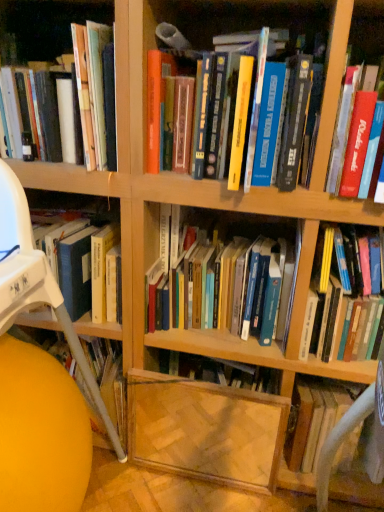
Describe the element at coordinates (41, 433) in the screenshot. I see `matte yellow ball at lower left` at that location.

At what (x,y) coordinates should I click in order to perform the action: click on hardcover books at center, which is counted as the 4th book, starting from the right. Please return your answer as a coordinate pair (x, y). Looking at the image, I should click on (176, 42).

What do you see at coordinates (352, 129) in the screenshot? The image size is (384, 512). I see `red matte book at upper right, which is the fourth book in left-to-right order` at bounding box center [352, 129].

Looking at this image, what is the approximate width of red matte book at upper right, which is the fourth book in left-to-right order?

red matte book at upper right, which is the fourth book in left-to-right order, is 36.42 centimeters wide.

What is the approximate width of white fabric computer chair at right?

white fabric computer chair at right is 14.34 inches wide.

I want to click on matte yellow ball at lower left, so click(x=41, y=433).

Based on their positions, is matte yellow ball at lower left located to the left or right of white fabric computer chair at right?

matte yellow ball at lower left is to the left of white fabric computer chair at right.

Which is behind, point (5, 429) or point (347, 423)?

Positioned behind is point (5, 429).

Would you say matte yellow ball at lower left is a long distance from white fabric computer chair at right?

No, matte yellow ball at lower left is in close proximity to white fabric computer chair at right.

From the picture: Is matte yellow ball at lower left smaller than white fabric computer chair at right?

No.

Considering the points (339, 440) and (352, 169), which point is behind, point (339, 440) or point (352, 169)?

The point (352, 169) is farther.

Choose the correct answer: Is white fabric computer chair at right inside red matte book at upper right, acting as the 2th book starting from the right, or outside it?

white fabric computer chair at right is outside red matte book at upper right, acting as the 2th book starting from the right.

From the image's perspective, does white fabric computer chair at right appear lower than red matte book at upper right, acting as the 2th book starting from the right?

Yes.

Does point (14, 434) appear closer or farther from the camera than point (282, 300)?

Point (14, 434) is positioned closer to the camera compared to point (282, 300).

From their relative heights in the image, would you say matte yellow ball at lower left is taller or shorter than hardcover books at center, the third book when ordered from right to left?

matte yellow ball at lower left is taller than hardcover books at center, the third book when ordered from right to left.

From a real-world perspective, is matte yellow ball at lower left positioned over hardcover books at center, the third book when ordered from left to right, based on gravity?

No.

From the image's perspective, which one is positioned higher, matte yellow ball at lower left or hardcover books at center, the third book when ordered from right to left?

From the image's view, hardcover books at center, the third book when ordered from right to left, is above.

Between hardcover book at upper left, the 1th book from the left, and hardcover book at center right, the 1th book when ordered from right to left, which one is positioned behind?

hardcover book at upper left, the 1th book from the left, is further away from the camera.

Looking at their sizes, would you say hardcover book at upper left, the fifth book when ordered from right to left, is wider or thinner than hardcover book at center right, which is counted as the 5th book, starting from the left?

Considering their sizes, hardcover book at upper left, the fifth book when ordered from right to left, looks slimmer than hardcover book at center right, which is counted as the 5th book, starting from the left.

Is hardcover book at upper left, the 1th book from the left, far from hardcover book at center right, which is counted as the 5th book, starting from the left?

hardcover book at upper left, the 1th book from the left, is actually quite close to hardcover book at center right, which is counted as the 5th book, starting from the left.

Is point (114, 135) closer or farther from the camera than point (372, 409)?

Point (114, 135) appears to be farther away from the viewer than point (372, 409).

Can white fabric computer chair at right be found inside hardcover book at upper left, the fifth book when ordered from right to left?

No, white fabric computer chair at right is not surrounded by hardcover book at upper left, the fifth book when ordered from right to left.

Are hardcover book at upper left, the fifth book when ordered from right to left, and white fabric computer chair at right making contact?

No.

From the image's perspective, does hardcover book at upper left, the fifth book when ordered from right to left, appear lower than white fabric computer chair at right?

No.

Which of these two, hardcover book at center right, which is counted as the 5th book, starting from the left, or hardcover books at center, the second book when ordered from left to right, stands taller?

hardcover book at center right, which is counted as the 5th book, starting from the left, is taller.

How much distance is there between hardcover book at center right, which is counted as the 5th book, starting from the left, and hardcover books at center, which is counted as the 4th book, starting from the right?

The distance of hardcover book at center right, which is counted as the 5th book, starting from the left, from hardcover books at center, which is counted as the 4th book, starting from the right, is 14.66 inches.

Considering the relative positions of hardcover book at center right, the 1th book when ordered from right to left, and hardcover books at center, the second book when ordered from left to right, in the image provided, is hardcover book at center right, the 1th book when ordered from right to left, to the right of hardcover books at center, the second book when ordered from left to right, from the viewer's perspective?

Correct, you'll find hardcover book at center right, the 1th book when ordered from right to left, to the right of hardcover books at center, the second book when ordered from left to right.

Is hardcover book at center right, the 1th book when ordered from right to left, directly adjacent to hardcover books at center, which is counted as the 4th book, starting from the right?

No, hardcover book at center right, the 1th book when ordered from right to left, is not beside hardcover books at center, which is counted as the 4th book, starting from the right.

Looking at this image, are hardcover book at upper left, the fifth book when ordered from right to left, and matte yellow ball at lower left making contact?

There is a gap between hardcover book at upper left, the fifth book when ordered from right to left, and matte yellow ball at lower left.

From a real-world perspective, who is located higher, hardcover book at upper left, the fifth book when ordered from right to left, or matte yellow ball at lower left?

hardcover book at upper left, the fifth book when ordered from right to left, is physically above.

Between hardcover book at upper left, the fifth book when ordered from right to left, and matte yellow ball at lower left, which one has less height?

hardcover book at upper left, the fifth book when ordered from right to left, is shorter.

Could you measure the distance between hardcover book at upper left, the fifth book when ordered from right to left, and matte yellow ball at lower left?

hardcover book at upper left, the fifth book when ordered from right to left, is 53.44 centimeters away from matte yellow ball at lower left.

Where is `computer chair located on the right of matte yellow ball at lower left`? This screenshot has height=512, width=384. computer chair located on the right of matte yellow ball at lower left is located at coordinates pyautogui.click(x=350, y=432).

Find the location of a particular element. Image resolution: width=384 pixels, height=512 pixels. the 3rd book above when counting from the white fabric computer chair at right (from the image's perspective) is located at coordinates (352, 129).

When comparing their distances from hardcover books at center, the third book when ordered from left to right, does white fabric computer chair at right or red matte book at upper right, acting as the 2th book starting from the right, seem further?

white fabric computer chair at right lies further to hardcover books at center, the third book when ordered from left to right, than the other object.

From the image, which object appears to be farther from wooden bookshelf at left, which is the 2th shelf in right-to-left order, hardcover book at center right, the 1th book when ordered from right to left, or hardcover books at center, the third book when ordered from right to left?

Based on the image, hardcover book at center right, the 1th book when ordered from right to left, appears to be further to wooden bookshelf at left, which is the 2th shelf in right-to-left order.

Considering their positions, is transparent glass shelf at lower center, the second shelf viewed from the left, positioned further to hardcover book at upper left, the 1th book from the left, than hardcover books at center, which is counted as the 4th book, starting from the right?

transparent glass shelf at lower center, the second shelf viewed from the left.

Estimate the real-world distances between objects in this image. Which object is further from hardcover books at center, the third book when ordered from left to right, transparent glass shelf at lower center, the second shelf viewed from the left, or hardcover book at center right, the 1th book when ordered from right to left?

Based on the image, transparent glass shelf at lower center, the second shelf viewed from the left, appears to be further to hardcover books at center, the third book when ordered from left to right.

Considering their positions, is white fabric computer chair at right positioned closer to wooden bookshelf at left, which ranks as the first shelf in left-to-right order, than transparent glass shelf at lower center, the second shelf viewed from the left?

The object closer to wooden bookshelf at left, which ranks as the first shelf in left-to-right order, is transparent glass shelf at lower center, the second shelf viewed from the left.

From the image, which object appears to be nearer to matte yellow ball at lower left, white fabric computer chair at right or transparent glass shelf at lower center, positioned as the 1th shelf in right-to-left order?

Based on the image, transparent glass shelf at lower center, positioned as the 1th shelf in right-to-left order, appears to be nearer to matte yellow ball at lower left.

Considering their positions, is hardcover book at center right, the 1th book when ordered from right to left, positioned closer to hardcover books at center, the second book when ordered from left to right, than white fabric computer chair at right?

Among the two, hardcover book at center right, the 1th book when ordered from right to left, is located nearer to hardcover books at center, the second book when ordered from left to right.

When comparing their distances from matte yellow ball at lower left, does wooden bookshelf at left, which is the 2th shelf in right-to-left order, or red matte book at upper right, which is the fourth book in left-to-right order, seem closer?

wooden bookshelf at left, which is the 2th shelf in right-to-left order.

Identify the location of book between hardcover books at center, the third book when ordered from right to left, and white fabric computer chair at right vertically. (325, 298).

Where is `shelf between wooden bookshelf at left, which is the 2th shelf in right-to-left order, and hardcover book at center right, which is counted as the 5th book, starting from the left, in the horizontal direction`? shelf between wooden bookshelf at left, which is the 2th shelf in right-to-left order, and hardcover book at center right, which is counted as the 5th book, starting from the left, in the horizontal direction is located at coordinates (206, 430).

At what (x,y) coordinates should I click in order to perform the action: click on computer chair between hardcover books at center, the third book when ordered from left to right, and transparent glass shelf at lower center, the second shelf viewed from the left, from top to bottom. Please return your answer as a coordinate pair (x, y). Image resolution: width=384 pixels, height=512 pixels. Looking at the image, I should click on (350, 432).

At what (x,y) coordinates should I click in order to perform the action: click on shelf between hardcover book at upper left, the 1th book from the left, and transparent glass shelf at lower center, positioned as the 1th shelf in right-to-left order, in the up-down direction. Please return your answer as a coordinate pair (x, y). This screenshot has height=512, width=384. Looking at the image, I should click on (86, 90).